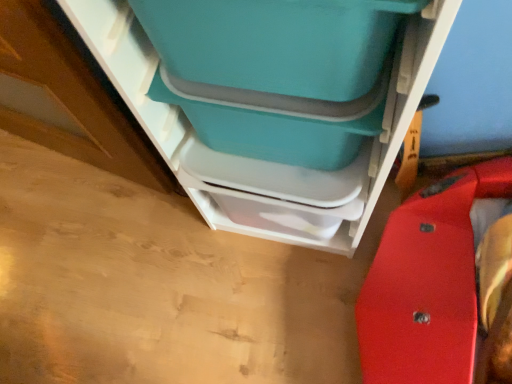
Locate an element on the screen. Image resolution: width=512 pixels, height=384 pixels. vacant point to the left of teal plastic storage bin at upper center is located at coordinates (185, 267).